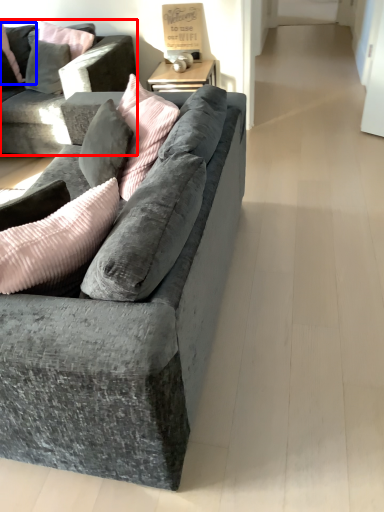
Question: Among these objects, which one is farthest to the camera, studio couch (highlighted by a red box) or pillow (highlighted by a blue box)?

Choices:
 (A) studio couch
 (B) pillow

Answer: (B)